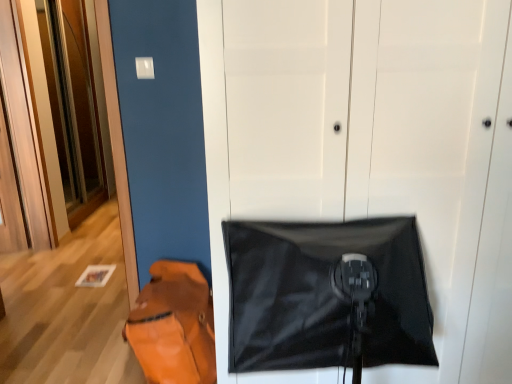
Question: From a real-world perspective, is black matte door at center, which is counted as the 1th door, starting from the front, over leather-like orange messenger bag at lower left?

Choices:
 (A) no
 (B) yes

Answer: (B)

Question: Does black matte door at center, marked as the 1th door in a right-to-left arrangement, have a greater width compared to leather-like orange messenger bag at lower left?

Choices:
 (A) no
 (B) yes

Answer: (B)

Question: Considering the relative positions of black matte door at center, marked as the 1th door in a right-to-left arrangement, and leather-like orange messenger bag at lower left in the image provided, is black matte door at center, marked as the 1th door in a right-to-left arrangement, in front of leather-like orange messenger bag at lower left?

Choices:
 (A) yes
 (B) no

Answer: (A)

Question: From a real-world perspective, is black matte door at center, which appears as the second door when viewed from the left, beneath leather-like orange messenger bag at lower left?

Choices:
 (A) yes
 (B) no

Answer: (B)

Question: Can you confirm if black matte door at center, which appears as the second door when viewed from the left, is shorter than leather-like orange messenger bag at lower left?

Choices:
 (A) no
 (B) yes

Answer: (A)

Question: Considering the positions of wooden at left, the second door in the front-to-back sequence, and black matte blanket at center in the image, is wooden at left, the second door in the front-to-back sequence, taller or shorter than black matte blanket at center?

Choices:
 (A) tall
 (B) short

Answer: (A)

Question: Considering the positions of wooden at left, arranged as the 1th door when viewed from the back, and black matte blanket at center in the image, is wooden at left, arranged as the 1th door when viewed from the back, wider or thinner than black matte blanket at center?

Choices:
 (A) thin
 (B) wide

Answer: (A)

Question: Is wooden at left, acting as the 2th door starting from the right, to the left or to the right of black matte blanket at center in the image?

Choices:
 (A) left
 (B) right

Answer: (A)

Question: Is wooden at left, arranged as the 1th door when viewed from the back, in front of or behind black matte blanket at center in the image?

Choices:
 (A) front
 (B) behind

Answer: (B)

Question: Considering the positions of point (173, 316) and point (239, 114), is point (173, 316) closer or farther from the camera than point (239, 114)?

Choices:
 (A) farther
 (B) closer

Answer: (A)

Question: From the image's perspective, is leather-like orange messenger bag at lower left above or below black matte door at center, marked as the 1th door in a right-to-left arrangement?

Choices:
 (A) above
 (B) below

Answer: (B)

Question: In terms of height, does leather-like orange messenger bag at lower left look taller or shorter compared to black matte door at center, which is counted as the 1th door, starting from the front?

Choices:
 (A) tall
 (B) short

Answer: (B)

Question: Is leather-like orange messenger bag at lower left bigger or smaller than black matte door at center, positioned as the 2th door in back-to-front order?

Choices:
 (A) big
 (B) small

Answer: (B)

Question: From a real-world perspective, is black matte blanket at center positioned above or below wooden at left, which is counted as the 1th door, starting from the left?

Choices:
 (A) above
 (B) below

Answer: (B)

Question: Is black matte blanket at center wider or thinner than wooden at left, acting as the 2th door starting from the right?

Choices:
 (A) wide
 (B) thin

Answer: (A)